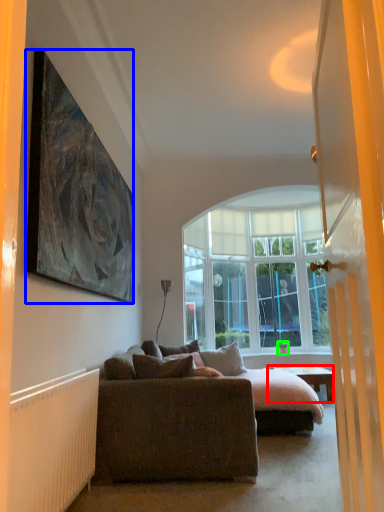
Question: Which object is positioned farthest from desk (highlighted by a red box)? Select from picture frame (highlighted by a blue box) and houseplant (highlighted by a green box).

Choices:
 (A) picture frame
 (B) houseplant

Answer: (A)